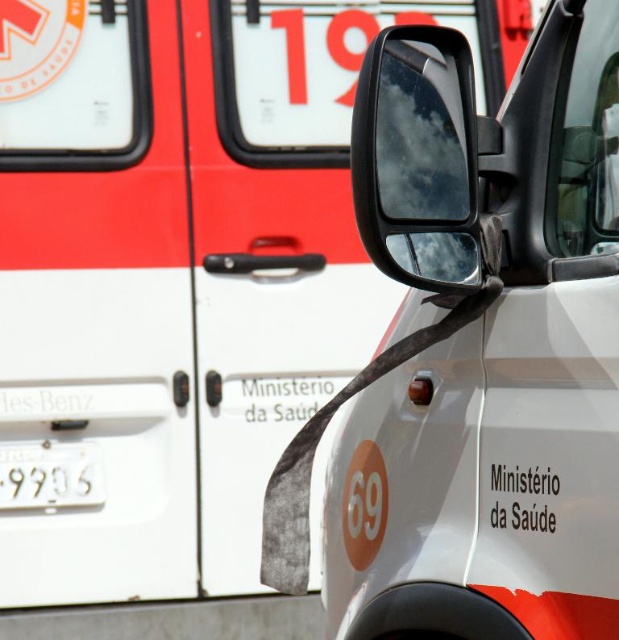
You are a technician inspecting the vehicle and need to locate the glossy plastic rearview mirror at upper center. According to the coordinates provided, where exactly should you look on the vehicle?

The glossy plastic rearview mirror at upper center is located at point coordinates (417,157) on the vehicle.

You are a delivery person trying to park your van next to the white matte car at center and the white metallic license plate at lower left. Based on their positions, which object should you avoid hitting when pulling into the parking spot?

The white metallic license plate at lower left is positioned to the left of the white matte car at center. To avoid hitting it, you should ensure your van does not encroach on the space where the license plate is located when parking.

You are a passenger in the Ministry of Health vehicle described. You notice two points marked on the vehicle body. The first point is at coordinates point (439,273) and the second is at point (19,465). If you were to look through the side mirror, which point would appear closer to you?

Point (439,273) is in front of point (19,465), so when looking through the side mirror, the point (439,273) would appear closer to you.